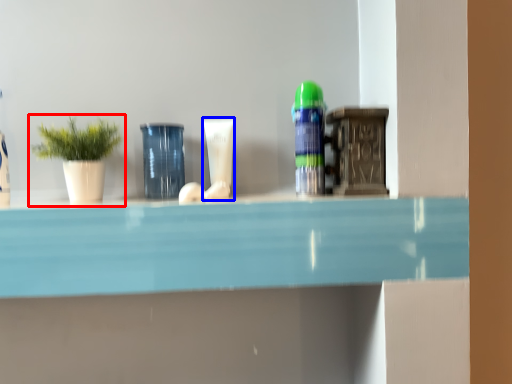
Question: Among these objects, which one is nearest to the camera, houseplant (highlighted by a red box) or toiletry (highlighted by a blue box)?

Choices:
 (A) houseplant
 (B) toiletry

Answer: (A)